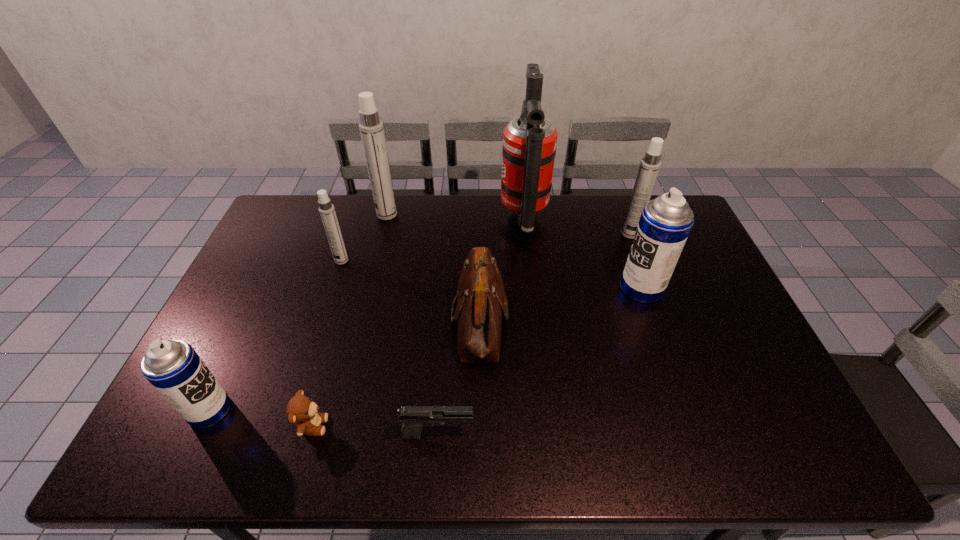
Where is `the left blue aerosol can`? the left blue aerosol can is located at coordinates (173, 367).

Locate an element on the screen. The image size is (960, 540). brown shoulder bag is located at coordinates (480, 305).

Find the location of `pistol`. pistol is located at coordinates (413, 418).

Locate an element on the screen. This screenshot has height=540, width=960. teddy bear is located at coordinates (301, 410).

The image size is (960, 540). Identify the location of free space located on the front label side of the fire extinguisher. (432, 218).

I want to click on free spot located 0.180m on the front label side of the fire extinguisher, so click(x=451, y=218).

This screenshot has height=540, width=960. In order to click on vacant space located 0.250m on the front label side of the fire extinguisher in this screenshot , I will do `click(432, 218)`.

Find the location of a particular element. The height and width of the screenshot is (540, 960). free space located 0.340m on the front of the biggest white aerosol can is located at coordinates (369, 288).

You are a GUI agent. You are given a task and a screenshot of the screen. Output one action in this format:
    pyautogui.click(x=<x>, y=<y>)
    Task: Click on the vacant space located 0.260m on the left of the rightmost white aerosol can
    
    Given the screenshot: What is the action you would take?
    pyautogui.click(x=548, y=234)

The height and width of the screenshot is (540, 960). In order to click on free space located on the label side of the second nearest aerosol can in this screenshot , I will do `click(565, 288)`.